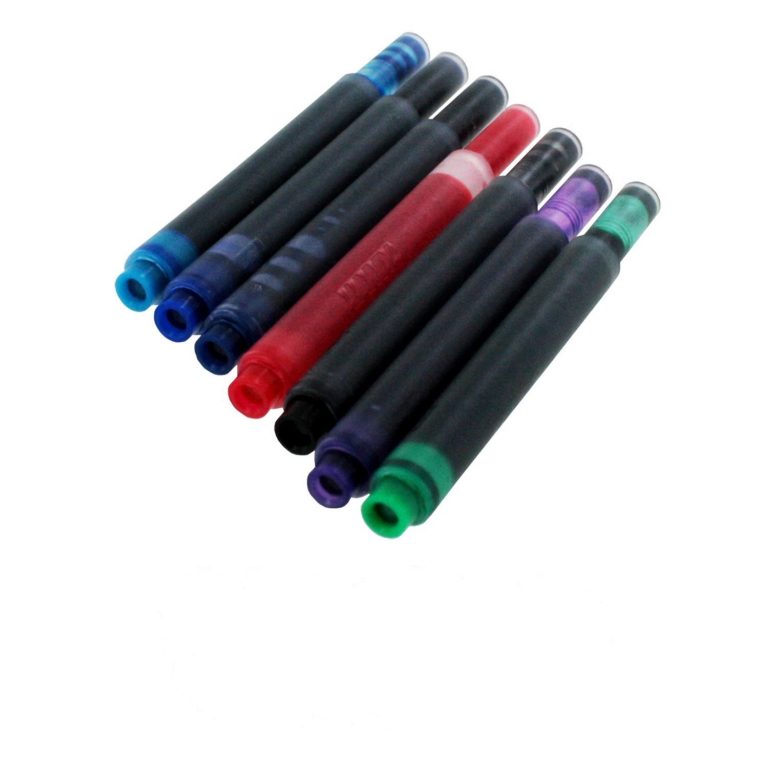
Where is `pens`? The width and height of the screenshot is (768, 768). pens is located at coordinates (270, 149), (303, 184), (342, 210), (369, 257), (406, 296), (449, 310), (508, 343).